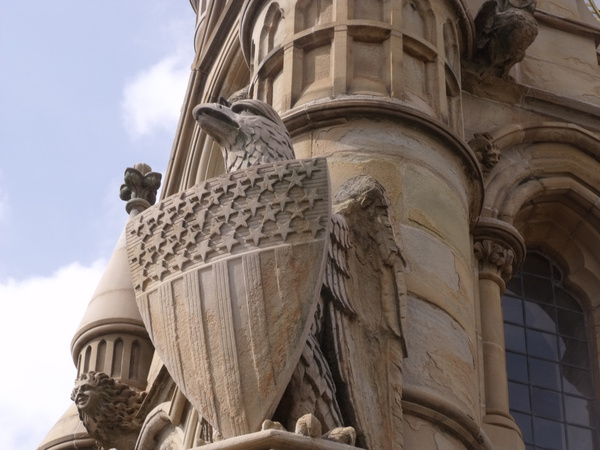
Locate an element on the screen. Image resolution: width=600 pixels, height=450 pixels. 1 column on the right is located at coordinates (418, 184).